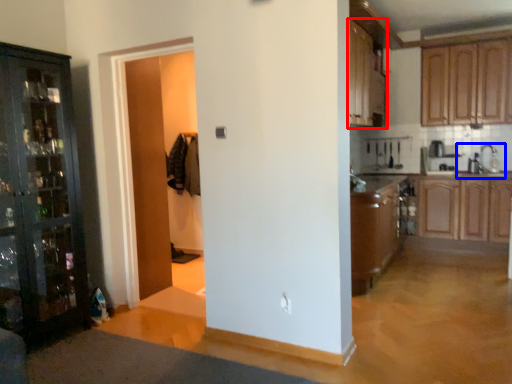
Question: Which object appears farthest to the camera in this image, cabinetry (highlighted by a red box) or sink (highlighted by a blue box)?

Choices:
 (A) cabinetry
 (B) sink

Answer: (B)